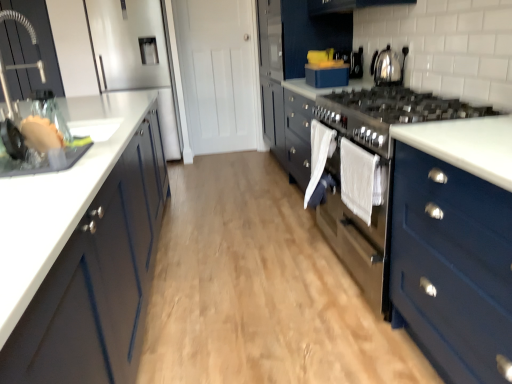
Where is `shiny metallic kettle at upper right`? shiny metallic kettle at upper right is located at coordinates (388, 66).

Which object is closer to the camera taking this photo, white cotton towel at center, which ranks as the 1th clothe in front-to-back order, or wooden floor at center?

Positioned in front is wooden floor at center.

Considering the relative positions of white cotton towel at center, marked as the 2th clothe in a back-to-front arrangement, and wooden floor at center in the image provided, is white cotton towel at center, marked as the 2th clothe in a back-to-front arrangement, to the right of wooden floor at center from the viewer's perspective?

Yes.

From the image's perspective, is white cotton towel at center, marked as the 2th clothe in a back-to-front arrangement, above or below wooden floor at center?

Based on their image positions, white cotton towel at center, marked as the 2th clothe in a back-to-front arrangement, is located above wooden floor at center.

From a real-world perspective, is blue matte box at upper center located higher than brushed metal faucet at left, which is the 2th cabinetry from left to right?

No, from a real-world perspective, blue matte box at upper center is not over brushed metal faucet at left, which is the 2th cabinetry from left to right

Does blue matte box at upper center appear on the right side of brushed metal faucet at left, which is the 2th cabinetry from left to right?

Correct, you'll find blue matte box at upper center to the right of brushed metal faucet at left, which is the 2th cabinetry from left to right.

How many degrees apart are the facing directions of blue matte box at upper center and brushed metal faucet at left, which is the 2th cabinetry from left to right?

There is a 178-degree angle between the facing directions of blue matte box at upper center and brushed metal faucet at left, which is the 2th cabinetry from left to right.

Are blue matte box at upper center and brushed metal faucet at left, which is the 2th cabinetry from left to right, far apart?

Yes, blue matte box at upper center is far from brushed metal faucet at left, which is the 2th cabinetry from left to right.

From the image's perspective, which is below, blue matte cabinet at lower right, which is the 1th cabinetry in right-to-left order, or white matte cabinet at left, the third cabinetry viewed from the right?

From the image's view, blue matte cabinet at lower right, which is the 1th cabinetry in right-to-left order, is below.

Considering the sizes of objects blue matte cabinet at lower right, which is the 1th cabinetry in right-to-left order, and white matte cabinet at left, the third cabinetry viewed from the right, in the image provided, who is shorter, blue matte cabinet at lower right, which is the 1th cabinetry in right-to-left order, or white matte cabinet at left, the third cabinetry viewed from the right,?

Standing shorter between the two is blue matte cabinet at lower right, which is the 1th cabinetry in right-to-left order.

Based on the photo, is blue matte cabinet at lower right, which is the 1th cabinetry in right-to-left order, inside the boundaries of white matte cabinet at left, which is the first cabinetry in left-to-right order, or outside?

blue matte cabinet at lower right, which is the 1th cabinetry in right-to-left order, is spatially situated outside white matte cabinet at left, which is the first cabinetry in left-to-right order.

Does point (438, 273) lie behind point (28, 360)?

Yes.

Find the location of a particular element. This screenshot has width=512, height=384. clothe below the white cotton towel at center, marked as the 2th clothe in a back-to-front arrangement (from a real-world perspective) is located at coordinates 319,155.

In the scene shown: Is white fabric towel at center, which is the 2th clothe in front-to-back order, outside of white cotton towel at center, marked as the 2th clothe in a back-to-front arrangement?

Yes.

Is white fabric towel at center, which is counted as the first clothe, starting from the back, not near white cotton towel at center, which ranks as the 1th clothe in front-to-back order?

No, white fabric towel at center, which is counted as the first clothe, starting from the back, is not far away from white cotton towel at center, which ranks as the 1th clothe in front-to-back order.

Considering the relative positions of white fabric towel at center, which is the 2th clothe in front-to-back order, and white cotton towel at center, marked as the 2th clothe in a back-to-front arrangement, in the image provided, is white fabric towel at center, which is the 2th clothe in front-to-back order, to the right of white cotton towel at center, marked as the 2th clothe in a back-to-front arrangement, from the viewer's perspective?

No.

Could you measure the distance between white matte cabinet at left, which is the first cabinetry in left-to-right order, and wooden floor at center?

white matte cabinet at left, which is the first cabinetry in left-to-right order, is 26.57 inches away from wooden floor at center.

Which object is thinner, white matte cabinet at left, the third cabinetry viewed from the right, or wooden floor at center?

white matte cabinet at left, the third cabinetry viewed from the right, is thinner.

Is white matte cabinet at left, which is the first cabinetry in left-to-right order, bigger than wooden floor at center?

Correct, white matte cabinet at left, which is the first cabinetry in left-to-right order, is larger in size than wooden floor at center.

Based on their positions, is white matte cabinet at left, which is the first cabinetry in left-to-right order, located to the left or right of wooden floor at center?

Clearly, white matte cabinet at left, which is the first cabinetry in left-to-right order, is on the left of wooden floor at center in the image.

Is white cotton towel at center, marked as the 2th clothe in a back-to-front arrangement, not close to blue matte box at upper center?

Indeed, white cotton towel at center, marked as the 2th clothe in a back-to-front arrangement, is not near blue matte box at upper center.

Where is `kitchen appliance above the white cotton towel at center, marked as the 2th clothe in a back-to-front arrangement (from a real-world perspective)`? kitchen appliance above the white cotton towel at center, marked as the 2th clothe in a back-to-front arrangement (from a real-world perspective) is located at coordinates [x=327, y=74].

What's the angular difference between white cotton towel at center, which ranks as the 1th clothe in front-to-back order, and blue matte box at upper center's facing directions?

They differ by 3.07 degrees in their facing directions.

Who is shorter, shiny metallic kettle at upper right or wooden floor at center?

wooden floor at center is shorter.

Is shiny metallic kettle at upper right wider or thinner than wooden floor at center?

shiny metallic kettle at upper right is thinner than wooden floor at center.

Relative to wooden floor at center, is shiny metallic kettle at upper right in front or behind?

Visually, shiny metallic kettle at upper right is located behind wooden floor at center.

From a real-world perspective, which object rests below the other?

wooden floor at center is physically lower.

Find the location of `clothe that is the 1st object located above the wooden floor at center (from the image's perspective)`. clothe that is the 1st object located above the wooden floor at center (from the image's perspective) is located at coordinates (357, 179).

Locate an element on the screen. The width and height of the screenshot is (512, 384). the 1st cabinetry counting from the left of the blue matte box at upper center is located at coordinates (40, 49).

Considering their positions, is blue matte box at upper center positioned further to blue matte cabinet at lower right, which is the 1th cabinetry in right-to-left order, than white fabric towel at center, which is the 2th clothe in front-to-back order?

Among the two, blue matte box at upper center is located further to blue matte cabinet at lower right, which is the 1th cabinetry in right-to-left order.

Looking at the image, which one is located further to white fabric towel at center, which is counted as the first clothe, starting from the back, blue matte box at upper center or brushed metal faucet at left, which is the 2th cabinetry from left to right?

brushed metal faucet at left, which is the 2th cabinetry from left to right, lies further to white fabric towel at center, which is counted as the first clothe, starting from the back, than the other object.

Which object lies nearer to the anchor point blue matte cabinet at lower right, which ranks as the third cabinetry in left-to-right order, white fabric towel at center, which is the 2th clothe in front-to-back order, or brushed metal faucet at left, the second cabinetry from the right?

white fabric towel at center, which is the 2th clothe in front-to-back order.

From the image, which object appears to be nearer to matte blue dresser at center, white cotton towel at center, which ranks as the 1th clothe in front-to-back order, or blue matte box at upper center?

white cotton towel at center, which ranks as the 1th clothe in front-to-back order.

Which object lies nearer to the anchor point white fabric towel at center, which is counted as the first clothe, starting from the back, blue matte cabinet at lower right, which is the 1th cabinetry in right-to-left order, or matte blue dresser at center?

matte blue dresser at center is positioned closer to the anchor white fabric towel at center, which is counted as the first clothe, starting from the back.

Estimate the real-world distances between objects in this image. Which object is closer to shiny metallic kettle at upper right, white matte cabinet at left, the third cabinetry viewed from the right, or white fabric towel at center, which is counted as the first clothe, starting from the back?

white fabric towel at center, which is counted as the first clothe, starting from the back, lies closer to shiny metallic kettle at upper right than the other object.

Which object lies nearer to the anchor point blue matte cabinet at lower right, which ranks as the third cabinetry in left-to-right order, shiny metallic kettle at upper right or white cotton towel at center, marked as the 2th clothe in a back-to-front arrangement?

white cotton towel at center, marked as the 2th clothe in a back-to-front arrangement, is closer to blue matte cabinet at lower right, which ranks as the third cabinetry in left-to-right order.

From the image, which object appears to be nearer to wooden floor at center, white fabric towel at center, which is counted as the first clothe, starting from the back, or blue matte cabinet at lower right, which ranks as the third cabinetry in left-to-right order?

The object closer to wooden floor at center is white fabric towel at center, which is counted as the first clothe, starting from the back.

The width and height of the screenshot is (512, 384). I want to click on home appliance between blue matte cabinet at lower right, which is the 1th cabinetry in right-to-left order, and blue matte box at upper center in the front-back direction, so click(388, 66).

In order to click on dresser located between white matte cabinet at left, the third cabinetry viewed from the right, and blue matte cabinet at lower right, which ranks as the third cabinetry in left-to-right order, in the left-right direction in this screenshot , I will do `click(430, 222)`.

Locate an element on the screen. Image resolution: width=512 pixels, height=384 pixels. kitchen appliance located between brushed metal faucet at left, which is the 2th cabinetry from left to right, and shiny metallic kettle at upper right in the left-right direction is located at coordinates (327, 74).

Where is `plain situated between brushed metal faucet at left, which is the 2th cabinetry from left to right, and white cotton towel at center, which ranks as the 1th clothe in front-to-back order, from left to right`? The width and height of the screenshot is (512, 384). plain situated between brushed metal faucet at left, which is the 2th cabinetry from left to right, and white cotton towel at center, which ranks as the 1th clothe in front-to-back order, from left to right is located at coordinates (259, 289).